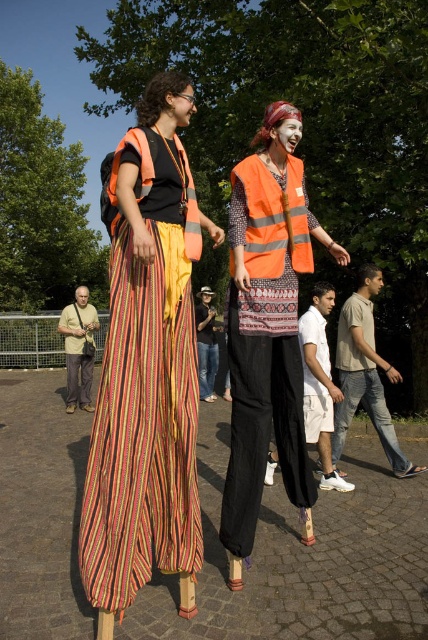
You are a photographer trying to capture the perfect shot of the beige cotton shirt at lower left. Based on the scene, where should you position your camera to ensure the shirt is in the frame?

To capture the beige cotton shirt at lower left, position your camera near the coordinates mentioned in the description, which is at point (79, 348) in the 2D space of the image.

You are a photographer trying to capture a photo of the beige cotton shirt at lower left and the denim jeans at center. Which one should you focus on first to ensure both are in sharp focus?

The beige cotton shirt at lower left is closer to the viewer than the denim jeans at center, so focus on the beige cotton shirt at lower left first to ensure both are in sharp focus.

You are a safety inspector checking the distance between two orange vests in the scene. The orange reflective vest at center and the matte orange vest at upper center must be at least 1.5 meters apart for safety regulations. Are they compliant?

The orange reflective vest at center and the matte orange vest at upper center are 1.34 meters apart, which is less than the required 1.5 meters. Therefore, they are not compliant with safety regulations.